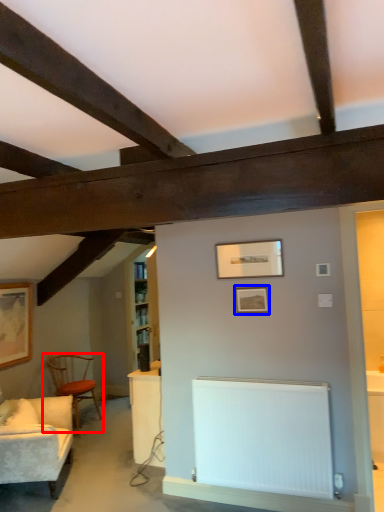
Question: Which object is further to the camera taking this photo, chair (highlighted by a red box) or picture frame (highlighted by a blue box)?

Choices:
 (A) chair
 (B) picture frame

Answer: (A)